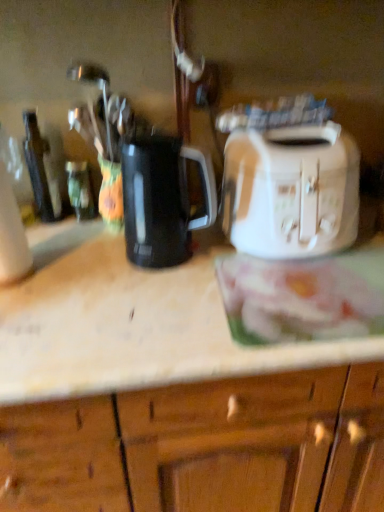
Question: Considering the relative positions of black plastic kettle at center and dark brown glass bottle at left, which appears as the second bottle when viewed from the right, in the image provided, is black plastic kettle at center to the left of dark brown glass bottle at left, which appears as the second bottle when viewed from the right, from the viewer's perspective?

Choices:
 (A) yes
 (B) no

Answer: (B)

Question: Is black plastic kettle at center facing away from dark brown glass bottle at left, acting as the first bottle starting from the left?

Choices:
 (A) yes
 (B) no

Answer: (B)

Question: Can you confirm if black plastic kettle at center is bigger than dark brown glass bottle at left, which appears as the second bottle when viewed from the right?

Choices:
 (A) no
 (B) yes

Answer: (B)

Question: Is black plastic kettle at center oriented towards dark brown glass bottle at left, acting as the first bottle starting from the left?

Choices:
 (A) no
 (B) yes

Answer: (A)

Question: Is black plastic kettle at center next to dark brown glass bottle at left, acting as the first bottle starting from the left, and touching it?

Choices:
 (A) no
 (B) yes

Answer: (A)

Question: From the image's perspective, is black plastic kettle at center under dark brown glass bottle at left, which appears as the second bottle when viewed from the right?

Choices:
 (A) no
 (B) yes

Answer: (B)

Question: Considering the relative positions of black plastic kettle at center and white plastic toaster at right in the image provided, is black plastic kettle at center to the left of white plastic toaster at right from the viewer's perspective?

Choices:
 (A) yes
 (B) no

Answer: (A)

Question: Is black plastic kettle at center oriented away from white plastic toaster at right?

Choices:
 (A) no
 (B) yes

Answer: (A)

Question: Is black plastic kettle at center wider than white plastic toaster at right?

Choices:
 (A) no
 (B) yes

Answer: (A)

Question: Does black plastic kettle at center have a smaller size compared to white plastic toaster at right?

Choices:
 (A) no
 (B) yes

Answer: (B)

Question: From the image's perspective, is black plastic kettle at center on white plastic toaster at right?

Choices:
 (A) no
 (B) yes

Answer: (A)

Question: Considering the relative positions of black plastic kettle at center and white plastic toaster at right in the image provided, is black plastic kettle at center behind white plastic toaster at right?

Choices:
 (A) no
 (B) yes

Answer: (A)

Question: Can you confirm if black plastic kettle at center is shorter than white glossy toaster at upper right?

Choices:
 (A) no
 (B) yes

Answer: (B)